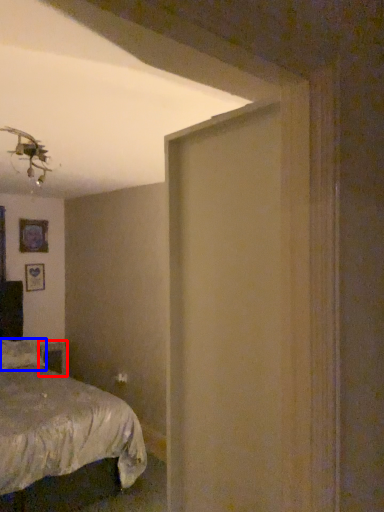
Question: Which object appears farthest to the camera in this image, table (highlighted by a red box) or pillow (highlighted by a blue box)?

Choices:
 (A) table
 (B) pillow

Answer: (A)